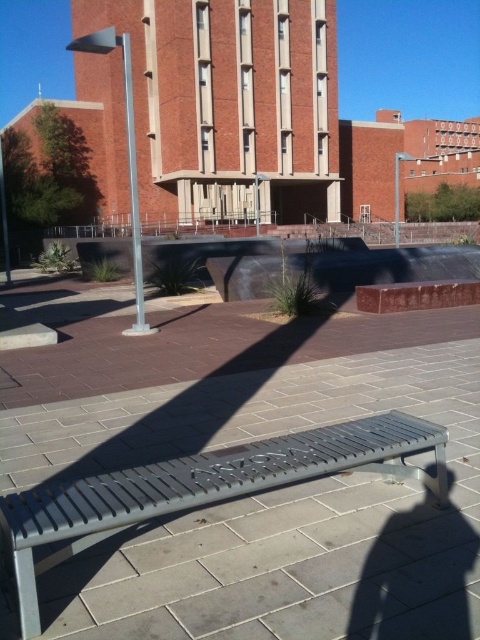
You are a visitor at the campus and want to sit on the gray metal bench at center. From your current position at the silver metallic pole at left, which direction should you move to reach the bench?

The gray metal bench at center is in front of the silver metallic pole at left, so you should move forward from the pole to reach the bench.

You are a visitor at this modern building and want to sit down. The gray metal bench at center and the metallic gray pole at center are both in your view. Which object is shorter?

The gray metal bench at center is shorter than the metallic gray pole at center.

You are a visitor at the campus and want to sit on the gray metal bench at center. However, you notice a metallic gray pole at center nearby. Which object is closer to you if you are standing in front of the building?

The gray metal bench at center is closer to you than the metallic gray pole at center because the bench is smaller in size, indicating it is nearer.